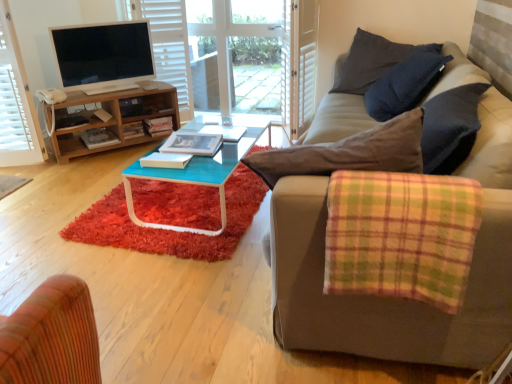
Where is `plaid fabric studio couch at right`? plaid fabric studio couch at right is located at coordinates (401, 299).

The height and width of the screenshot is (384, 512). In order to click on matte black tv at upper left in this screenshot , I will do pyautogui.click(x=103, y=54).

What is the approximate height of white wood screen door at upper center?

white wood screen door at upper center is 3.51 feet in height.

In order to face shaggy red rug at center, should I rotate leftwards or rightwards?

To align with it, rotate left about 8.644°.

The width and height of the screenshot is (512, 384). Describe the element at coordinates (401, 236) in the screenshot. I see `plaid fabric cushion at right` at that location.

Locate an element on the screen. The height and width of the screenshot is (384, 512). plaid fabric studio couch at right is located at coordinates (401, 299).

Could you tell me if transparent glass door at upper center is turned towards dark gray cotton pillow at upper right?

No, transparent glass door at upper center is not turned towards dark gray cotton pillow at upper right.

Considering their positions, is transparent glass door at upper center located in front of or behind dark gray cotton pillow at upper right?

In the image, transparent glass door at upper center appears behind dark gray cotton pillow at upper right.

From the image's perspective, between transparent glass door at upper center and dark gray cotton pillow at upper right, which one is located above?

From the image's view, transparent glass door at upper center is above.

Is transparent glass door at upper center not close to dark gray cotton pillow at upper right?

Absolutely, transparent glass door at upper center is distant from dark gray cotton pillow at upper right.

The image size is (512, 384). I want to click on studio couch lying on the left of white wood screen door at upper center, so click(x=401, y=299).

Which object is further away from the camera, white wood screen door at upper center or plaid fabric studio couch at right?

white wood screen door at upper center is further away from the camera.

Is white wood screen door at upper center smaller than plaid fabric studio couch at right?

Yes.

Is white wood screen door at upper center touching plaid fabric studio couch at right?

There is a gap between white wood screen door at upper center and plaid fabric studio couch at right.

Does dark gray cotton pillow at upper right appear on the right side of plaid fabric cushion at right?

Indeed, dark gray cotton pillow at upper right is positioned on the right side of plaid fabric cushion at right.

Does point (354, 56) come closer to viewer compared to point (339, 207)?

No, (354, 56) is behind (339, 207).

From a real-world perspective, who is located lower, dark gray cotton pillow at upper right or plaid fabric cushion at right?

plaid fabric cushion at right is physically lower.

Considering the relative sizes of dark gray cotton pillow at upper right and plaid fabric cushion at right in the image provided, is dark gray cotton pillow at upper right smaller than plaid fabric cushion at right?

No.

In order to click on curtain located behind the plaid fabric cushion at right in this screenshot , I will do `click(12, 93)`.

Is plaid fabric cushion at right not inside white sheer curtain at upper left?

plaid fabric cushion at right lies outside white sheer curtain at upper left's area.

From a real-world perspective, is plaid fabric cushion at right positioned above or below white sheer curtain at upper left?

plaid fabric cushion at right is below white sheer curtain at upper left.

Is plaid fabric cushion at right aimed at white sheer curtain at upper left?

No, plaid fabric cushion at right is not turned towards white sheer curtain at upper left.

Is matte black tv at upper left to the left or to the right of plaid fabric cushion at right in the image?

From the image, it's evident that matte black tv at upper left is to the left of plaid fabric cushion at right.

Does matte black tv at upper left turn towards plaid fabric cushion at right?

Yes.

Is the position of matte black tv at upper left less distant than that of plaid fabric cushion at right?

That is False.

From a real-world perspective, is white plastic phone at left beneath matte black tv at upper left?

Yes, from a real-world perspective, white plastic phone at left is under matte black tv at upper left.

The height and width of the screenshot is (384, 512). In order to click on corded phone that is behind the matte black tv at upper left in this screenshot , I will do `click(51, 96)`.

Which is in front, point (46, 92) or point (94, 39)?

The point (46, 92) is closer to the camera.

Looking at their sizes, would you say white plastic phone at left is wider or thinner than matte black tv at upper left?

Considering their sizes, white plastic phone at left looks broader than matte black tv at upper left.

Is point (300, 48) positioned after point (117, 144)?

No.

From the image's perspective, between white wood screen door at upper center and wooden entertainment center at left, which one is located above?

white wood screen door at upper center appears higher in the image.

Is white wood screen door at upper center facing away from wooden entertainment center at left?

No, white wood screen door at upper center is not facing away from wooden entertainment center at left.

In the scene shown: Between white wood screen door at upper center and wooden entertainment center at left, which one has smaller width?

white wood screen door at upper center is thinner.

Where is `glass door on the left side of dark gray cotton pillow at upper right`? The width and height of the screenshot is (512, 384). glass door on the left side of dark gray cotton pillow at upper right is located at coordinates (239, 51).

Find the location of `screen door located above the plaid fabric studio couch at right (from the image's perspective)`. screen door located above the plaid fabric studio couch at right (from the image's perspective) is located at coordinates (x=302, y=64).

Estimate the real-world distances between objects in this image. Which object is closer to matte black tv at upper left, dark gray cotton pillow at upper right or plaid fabric cushion at right?

dark gray cotton pillow at upper right lies closer to matte black tv at upper left than the other object.

From the picture: Estimate the real-world distances between objects in this image. Which object is closer to wooden entertainment center at left, plaid fabric cushion at right or shaggy red rug at center?

shaggy red rug at center.

Considering their positions, is white matte shutter at upper left positioned closer to plaid fabric cushion at right than transparent glass door at upper center?

Among the two, white matte shutter at upper left is located nearer to plaid fabric cushion at right.

Which object lies further to the anchor point wooden entertainment center at left, white sheer curtain at upper left or white wood screen door at upper center?

white wood screen door at upper center lies further to wooden entertainment center at left than the other object.

When comparing their distances from transparent glass door at upper center, does white plastic phone at left or white matte shutter at upper left seem closer?

white matte shutter at upper left lies closer to transparent glass door at upper center than the other object.

From the image, which object appears to be nearer to white wood screen door at upper center, plaid fabric studio couch at right or matte black tv at upper left?

matte black tv at upper left is closer to white wood screen door at upper center.

From the picture: Based on their spatial positions, is shaggy red rug at center or matte black tv at upper left closer to dark gray cotton pillow at upper right?

shaggy red rug at center is closer to dark gray cotton pillow at upper right.

When comparing their distances from plaid fabric studio couch at right, does wooden entertainment center at left or white matte shutter at upper left seem further?

Among the two, white matte shutter at upper left is located further to plaid fabric studio couch at right.

I want to click on mat between wooden entertainment center at left and dark gray cotton pillow at upper right from left to right, so click(x=168, y=230).

The image size is (512, 384). I want to click on entertainment center situated between white plastic phone at left and white wood screen door at upper center from left to right, so click(106, 87).

Locate an element on the screen. This screenshot has height=384, width=512. pillow between plaid fabric cushion at right and white wood screen door at upper center from front to back is located at coordinates (373, 61).

Locate an element on the screen. This screenshot has width=512, height=384. entertainment center situated between white sheer curtain at upper left and transparent glass door at upper center from left to right is located at coordinates (106, 87).